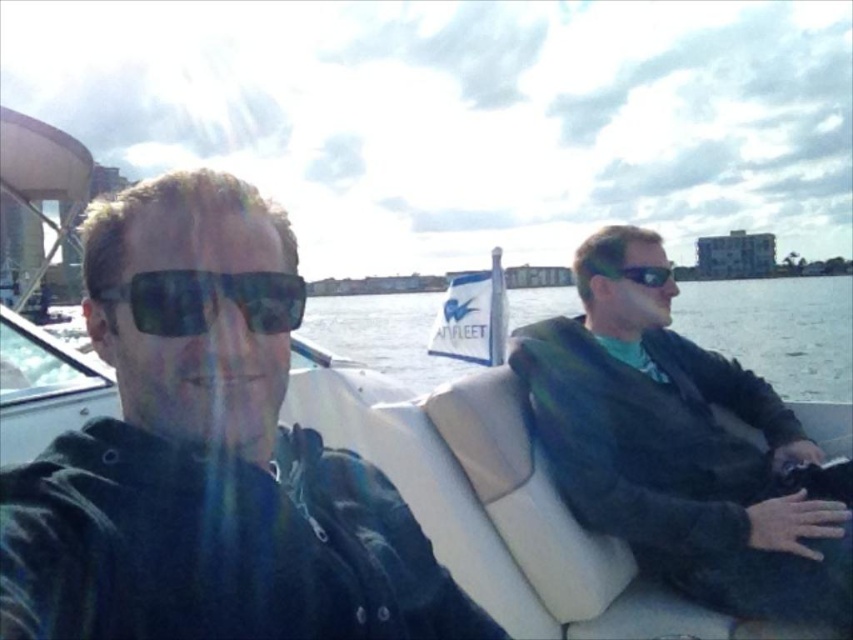
Question: Is green sweater at right closer to the viewer compared to black reflective sunglasses at right?

Choices:
 (A) yes
 (B) no

Answer: (A)

Question: Among these points, which one is farthest from the camera?

Choices:
 (A) (682, 429)
 (B) (799, 291)
 (C) (161, 326)

Answer: (B)

Question: Estimate the real-world distances between objects in this image. Which object is closer to the green sweater at right?

Choices:
 (A) matte black sunglasses at left
 (B) matte black jacket at left
 (C) clear water at center

Answer: (B)

Question: Can you confirm if green sweater at right is positioned to the left of black reflective sunglasses at right?

Choices:
 (A) no
 (B) yes

Answer: (A)

Question: Which object appears farthest from the camera in this image?

Choices:
 (A) clear water at center
 (B) black reflective sunglasses at right

Answer: (B)

Question: Can you confirm if clear water at center is smaller than black reflective sunglasses at right?

Choices:
 (A) no
 (B) yes

Answer: (A)